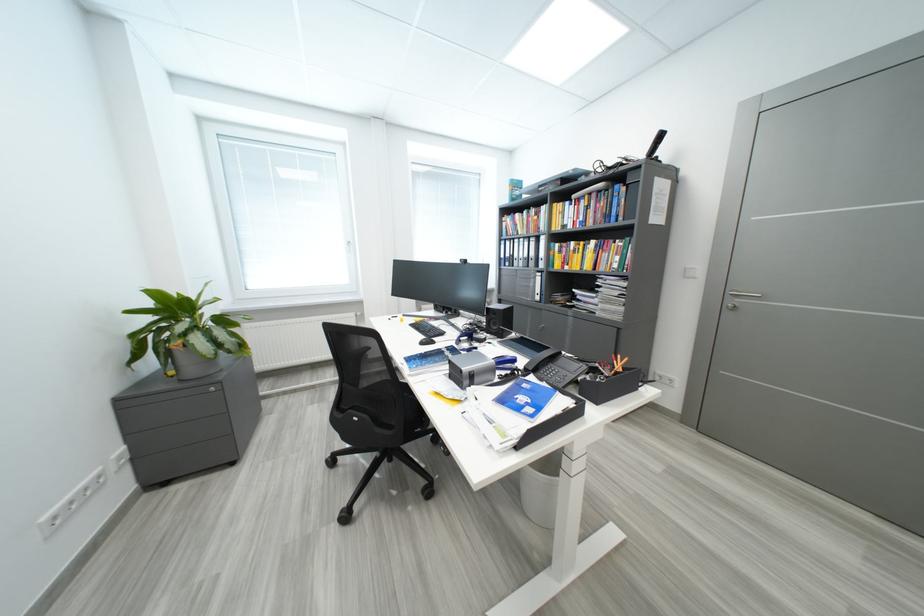
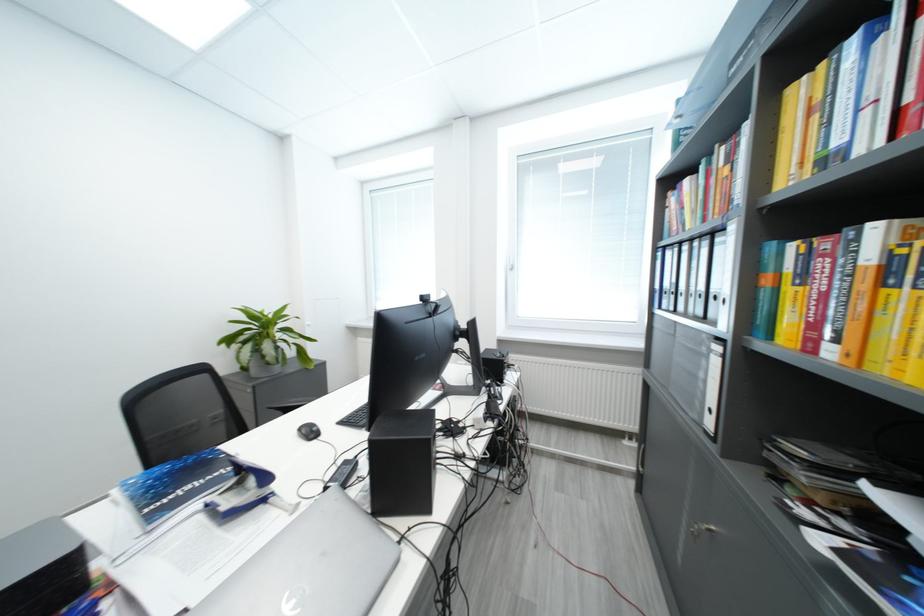
Locate, in the second image, the point that corresponds to pixel 508 243 in the first image.

(664, 253)